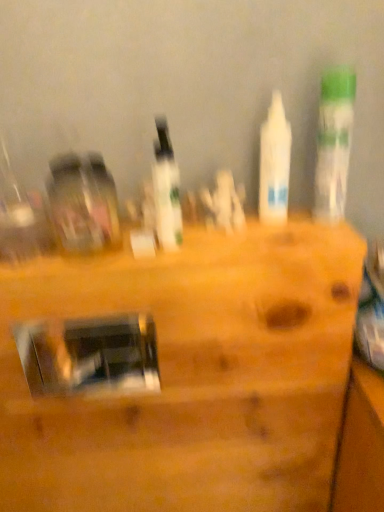
Locate an element on the screen. The height and width of the screenshot is (512, 384). vacant space in front of white matte bottle at center, which is the 2th bottle from right to left is located at coordinates (286, 239).